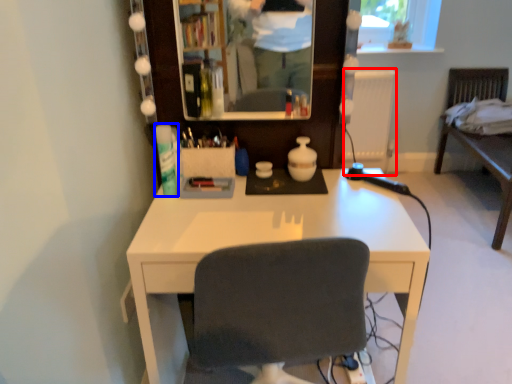
Question: Among these objects, which one is farthest to the camera, radiator (highlighted by a red box) or toiletry (highlighted by a blue box)?

Choices:
 (A) radiator
 (B) toiletry

Answer: (A)